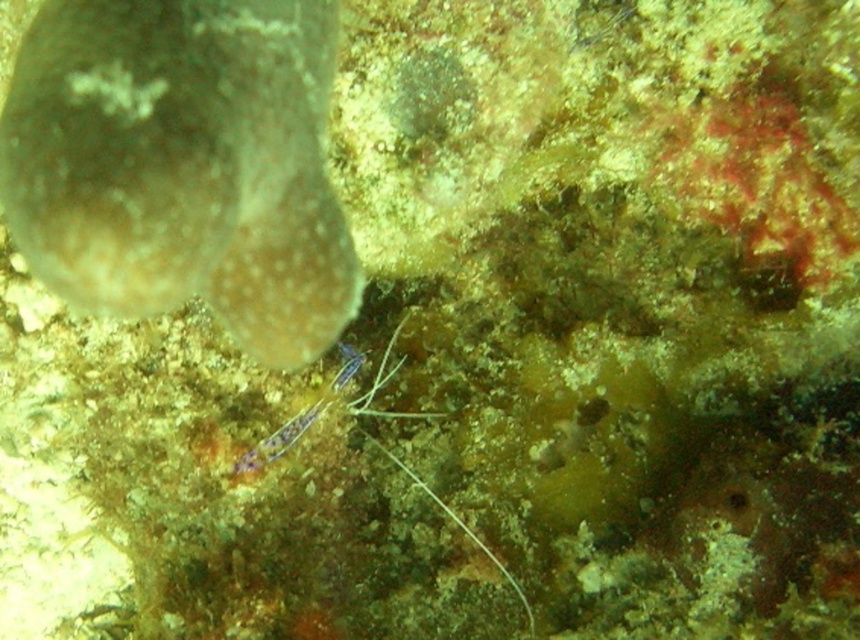
You are a marine biologist studying underwater life. You observe the brown speckled shell at upper left and the purple iridescent shrimp at center in the image. Which object is taller?

The brown speckled shell at upper left is taller than the purple iridescent shrimp at center.

You are a marine biologist examining an underwater image. You notice two points of interest labeled as point (244,348) and point (304,428). Which point is nearer to your position as the observer?

Point (244,348) is closer to the viewer than point (304,428).